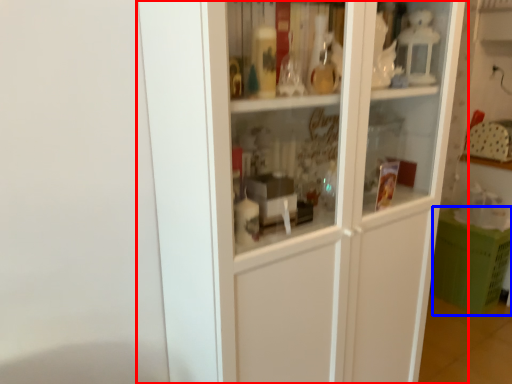
Question: Among these objects, which one is farthest to the camera, cupboard (highlighted by a red box) or cabinetry (highlighted by a blue box)?

Choices:
 (A) cupboard
 (B) cabinetry

Answer: (B)